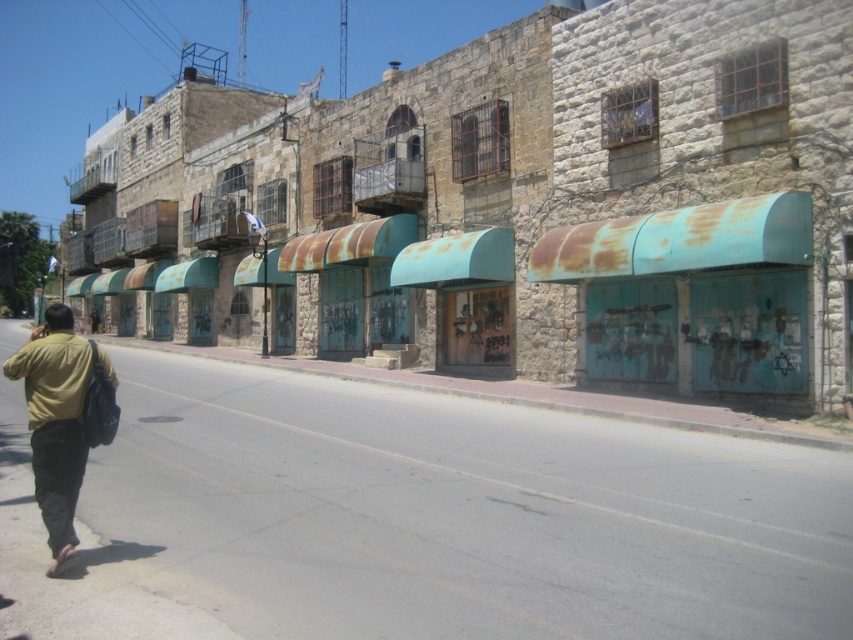
Question: Does matte yellow shirt at lower left appear over yellow matte jacket at lower left?

Choices:
 (A) yes
 (B) no

Answer: (B)

Question: Is matte yellow shirt at lower left below dark brown leather jacket at lower left?

Choices:
 (A) yes
 (B) no

Answer: (A)

Question: Which point is closer to the camera?

Choices:
 (A) (97, 330)
 (B) (80, 403)
 (C) (54, 340)

Answer: (B)

Question: Which of the following is the closest to the observer?

Choices:
 (A) (90, 314)
 (B) (35, 381)

Answer: (B)

Question: Which object appears farthest from the camera in this image?

Choices:
 (A) dark brown leather jacket at lower left
 (B) matte yellow shirt at lower left

Answer: (A)

Question: Is yellow matte jacket at lower left further to camera compared to dark brown leather jacket at lower left?

Choices:
 (A) yes
 (B) no

Answer: (B)